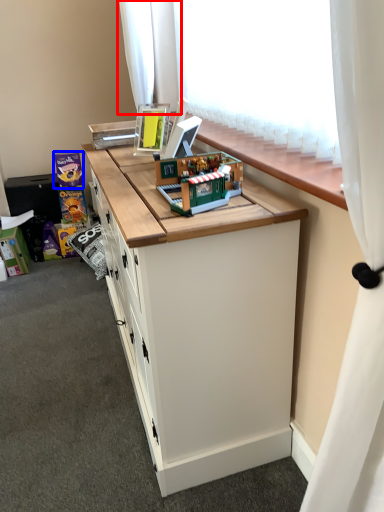
Question: Which object appears closest to the camera in this image, curtain (highlighted by a red box) or toy (highlighted by a blue box)?

Choices:
 (A) curtain
 (B) toy

Answer: (A)